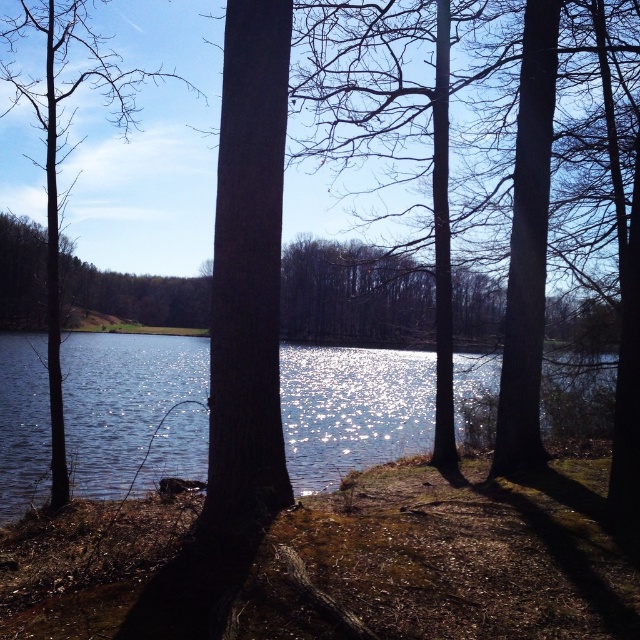
Which is in front, point (460, 380) or point (65, 33)?

Point (65, 33) is in front.

Is glistening water at center shorter than brown matte tree at left?

Yes, glistening water at center is shorter than brown matte tree at left.

Is point (385, 422) positioned in front of point (52, 81)?

Yes, point (385, 422) is in front of point (52, 81).

At what (x,y) coordinates should I click in order to perform the action: click on glistening water at center. Please return your answer as a coordinate pair (x, y). This screenshot has width=640, height=640. Looking at the image, I should click on (353, 410).